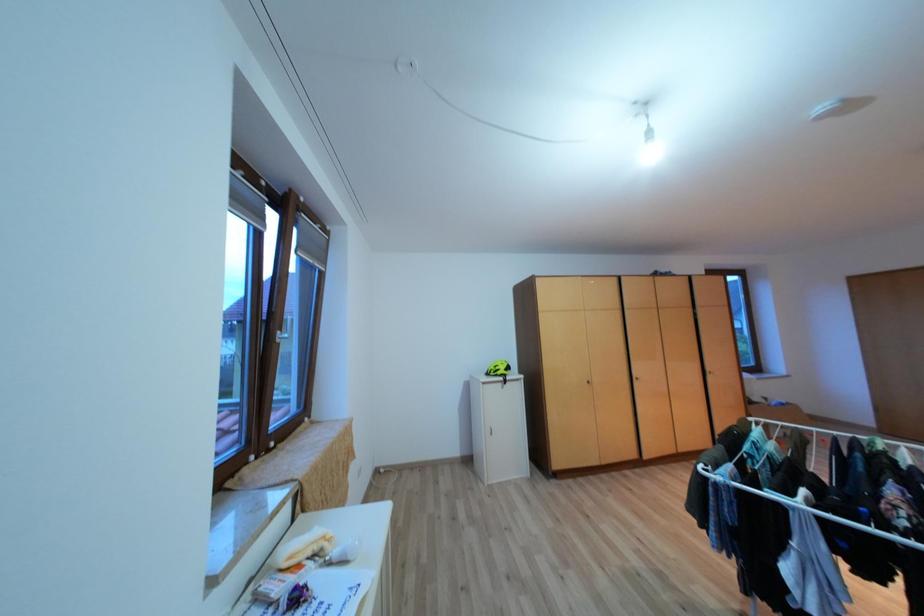
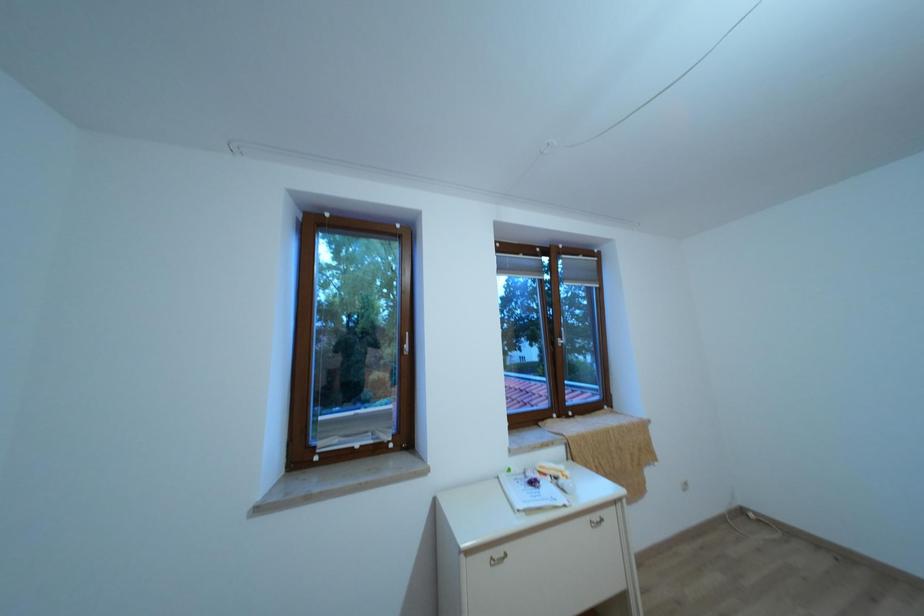
Question: The camera is either moving clockwise (left) or counter-clockwise (right) around the object. The first image is from the beginning of the video and the second image is from the end. Is the camera moving left or right when shooting the video?

Choices:
 (A) Left
 (B) Right

Answer: (B)